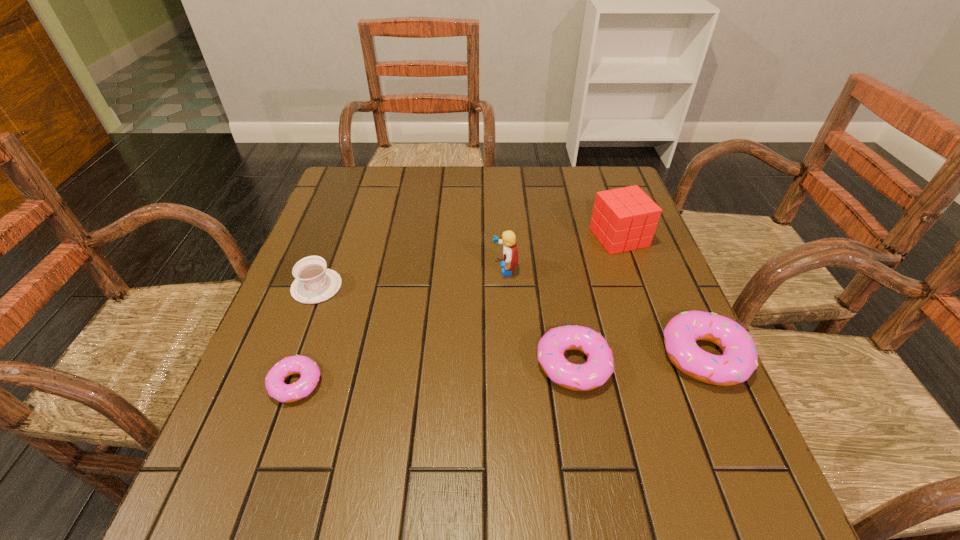
You are a GUI agent. You are given a task and a screenshot of the screen. Output one action in this format:
    pyautogui.click(x=<x>, y=<y>)
    Task: Click on the free space between the teacup and the Lego
    
    Given the screenshot: What is the action you would take?
    point(411,278)

Locate an element on the screen. vacant space in between the farthest object and the fourth object from left to right is located at coordinates (596, 301).

Where is `empty space that is in between the farthest object and the Lego`? empty space that is in between the farthest object and the Lego is located at coordinates (562, 253).

This screenshot has width=960, height=540. I want to click on free space between the teacup and the shortest doughnut, so click(306, 335).

Identify the location of empty space that is in between the farthest object and the second tallest doughnut. (596, 301).

Where is `free area in between the teacup and the leftmost doughnut`? This screenshot has height=540, width=960. free area in between the teacup and the leftmost doughnut is located at coordinates (306, 335).

Locate an element on the screen. This screenshot has height=540, width=960. empty space between the second doughnut from right to left and the teacup is located at coordinates (444, 326).

Where is `unoccupied position between the teacup and the rightmost doughnut`? The image size is (960, 540). unoccupied position between the teacup and the rightmost doughnut is located at coordinates (511, 321).

Where is `free space between the shortest doughnut and the third object from left to right`? Image resolution: width=960 pixels, height=540 pixels. free space between the shortest doughnut and the third object from left to right is located at coordinates (400, 327).

This screenshot has width=960, height=540. I want to click on empty space that is in between the third object from right to left and the teacup, so click(x=444, y=326).